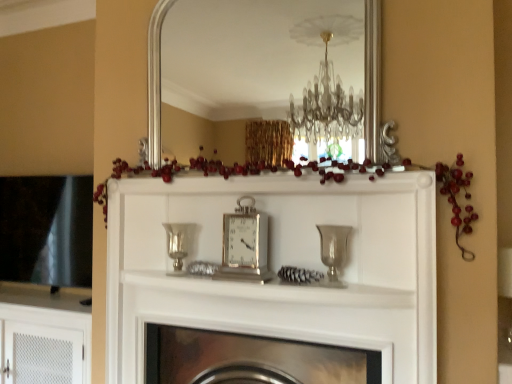
Question: Does white textured cabinet at lower left have a lesser height compared to silver/metallic mirror at upper center?

Choices:
 (A) yes
 (B) no

Answer: (A)

Question: From the image's perspective, is white textured cabinet at lower left on top of silver/metallic mirror at upper center?

Choices:
 (A) yes
 (B) no

Answer: (B)

Question: From a real-world perspective, is white textured cabinet at lower left physically below silver/metallic mirror at upper center?

Choices:
 (A) yes
 (B) no

Answer: (A)

Question: Can you confirm if white textured cabinet at lower left is positioned to the right of silver/metallic mirror at upper center?

Choices:
 (A) yes
 (B) no

Answer: (B)

Question: Would you say white textured cabinet at lower left is a long distance from silver/metallic mirror at upper center?

Choices:
 (A) yes
 (B) no

Answer: (A)

Question: Is silver/metallic mirror at upper center spatially inside silver/metallic clock at center, or outside of it?

Choices:
 (A) outside
 (B) inside

Answer: (A)

Question: From a real-world perspective, is silver/metallic mirror at upper center positioned above or below silver/metallic clock at center?

Choices:
 (A) below
 (B) above

Answer: (B)

Question: Looking at their shapes, would you say silver/metallic mirror at upper center is wider or thinner than silver/metallic clock at center?

Choices:
 (A) thin
 (B) wide

Answer: (A)

Question: Based on their sizes in the image, would you say silver/metallic mirror at upper center is bigger or smaller than silver/metallic clock at center?

Choices:
 (A) big
 (B) small

Answer: (A)

Question: From the image's perspective, is metallic silver fireplace at center located above or below silver metallic vase at center, which is counted as the 2th candle holder, starting from the front?

Choices:
 (A) above
 (B) below

Answer: (B)

Question: From their relative heights in the image, would you say metallic silver fireplace at center is taller or shorter than silver metallic vase at center, arranged as the 1th candle holder when viewed from the left?

Choices:
 (A) tall
 (B) short

Answer: (A)

Question: Is point (241, 360) closer or farther from the camera than point (185, 241)?

Choices:
 (A) farther
 (B) closer

Answer: (B)

Question: Looking at their shapes, would you say metallic silver fireplace at center is wider or thinner than silver metallic vase at center, which is counted as the 2th candle holder, starting from the front?

Choices:
 (A) wide
 (B) thin

Answer: (A)

Question: Considering the positions of silver metallic vase at center, arranged as the 1th candle holder when viewed from the left, and silver/metallic mirror at upper center in the image, is silver metallic vase at center, arranged as the 1th candle holder when viewed from the left, taller or shorter than silver/metallic mirror at upper center?

Choices:
 (A) tall
 (B) short

Answer: (B)

Question: From a real-world perspective, is silver metallic vase at center, which is the second candle holder in right-to-left order, physically located above or below silver/metallic mirror at upper center?

Choices:
 (A) below
 (B) above

Answer: (A)